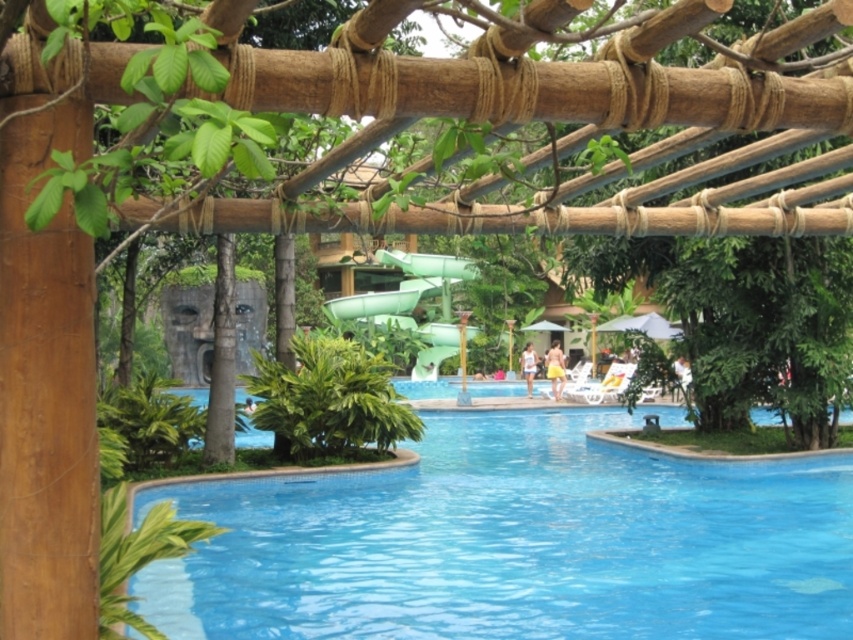
You are standing in the water park and want to take a photo of the blue glossy pool at center and the green rubber slide at center. Which object should you focus on first to ensure it appears sharp in your photo?

You should focus on the blue glossy pool at center first because it is closer to the viewer than the green rubber slide at center.

You are planning to install a new water slide in the water park. The current green rubber slide at center is narrower than the blue glossy pool at center. If you want to replace the slide with a wider one, would the new slide fit within the pool area?

The blue glossy pool at center is wider than the green rubber slide at center. Since the new slide needs to be wider, it may still fit within the pool area as the pool itself is wider, but the exact fit depends on the slide dimensions compared to the pool width.